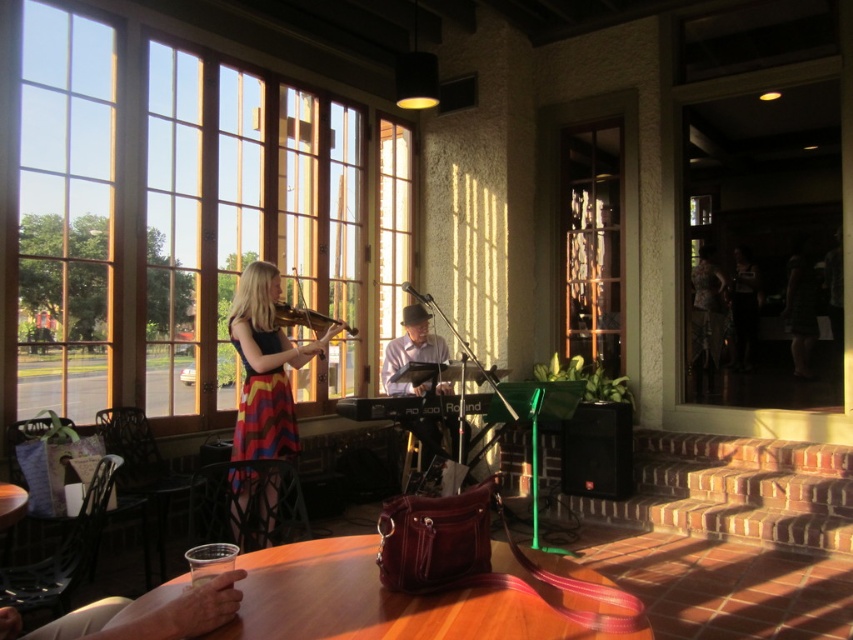
Question: Among these points, which one is nearest to the camera?

Choices:
 (A) (289, 353)
 (B) (277, 317)
 (C) (454, 435)

Answer: (A)

Question: Does wooden table at lower center lie behind wooden violin at center?

Choices:
 (A) no
 (B) yes

Answer: (A)

Question: Which is farther from the wooden violin at center?

Choices:
 (A) clear glass window at left
 (B) wooden table at lower center

Answer: (B)

Question: Does multicolored fabric dress at center appear on the right side of wooden violin at center?

Choices:
 (A) no
 (B) yes

Answer: (B)

Question: Which of the following is the farthest from the observer?

Choices:
 (A) multicolored fabric dress at center
 (B) wooden table at lower center
 (C) clear glass window at center
 (D) light purple fabric keyboard at center

Answer: (C)

Question: Can you confirm if clear glass window at center is positioned to the left of wooden violin at center?

Choices:
 (A) no
 (B) yes

Answer: (A)